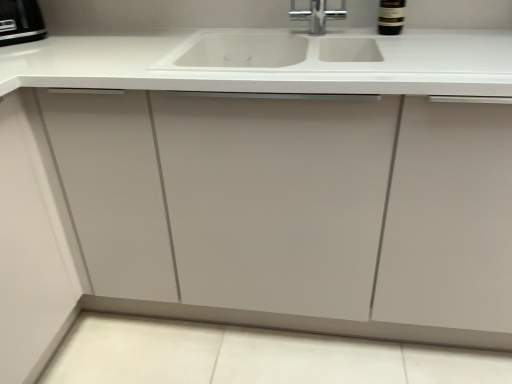
The height and width of the screenshot is (384, 512). I want to click on dark brown glass bottle at upper right, so click(391, 17).

What do you see at coordinates (391, 17) in the screenshot? I see `dark brown glass bottle at upper right` at bounding box center [391, 17].

Describe the element at coordinates (269, 62) in the screenshot. The width and height of the screenshot is (512, 384). I see `white matte sink at center` at that location.

What do you see at coordinates (20, 22) in the screenshot?
I see `black plastic toaster at upper left` at bounding box center [20, 22].

This screenshot has height=384, width=512. I want to click on dark brown glass bottle at upper right, so click(391, 17).

Which object is further away from the camera, black plastic toaster at upper left or dark brown glass bottle at upper right?

black plastic toaster at upper left is further from the camera.

Between point (6, 27) and point (392, 1), which one is positioned behind?

Positioned behind is point (392, 1).

Considering the relative sizes of black plastic toaster at upper left and dark brown glass bottle at upper right in the image provided, is black plastic toaster at upper left thinner than dark brown glass bottle at upper right?

Incorrect, the width of black plastic toaster at upper left is not less than that of dark brown glass bottle at upper right.

I want to click on wine bottle on the right of the black plastic toaster at upper left, so click(x=391, y=17).

Where is `countertop that is in front of the dark brown glass bottle at upper right`? countertop that is in front of the dark brown glass bottle at upper right is located at coordinates (269, 62).

Between dark brown glass bottle at upper right and white matte sink at center, which one has less height?

white matte sink at center.

Considering the relative sizes of dark brown glass bottle at upper right and white matte sink at center in the image provided, is dark brown glass bottle at upper right wider than white matte sink at center?

No.

Is dark brown glass bottle at upper right oriented away from white matte sink at center?

No, dark brown glass bottle at upper right is not facing away from white matte sink at center.

Where is `countertop in front of the black plastic toaster at upper left`? This screenshot has height=384, width=512. countertop in front of the black plastic toaster at upper left is located at coordinates (269, 62).

Can you confirm if white matte sink at center is shorter than black plastic toaster at upper left?

No, white matte sink at center is not shorter than black plastic toaster at upper left.

Between white matte sink at center and black plastic toaster at upper left, which one has larger width?

white matte sink at center.

Considering their positions, is white matte sink at center located in front of or behind black plastic toaster at upper left?

In the image, white matte sink at center appears in front of black plastic toaster at upper left.

In terms of size, does dark brown glass bottle at upper right appear bigger or smaller than black plastic toaster at upper left?

Clearly, dark brown glass bottle at upper right is smaller in size than black plastic toaster at upper left.

Considering the points (395, 10) and (4, 19), which point is behind, point (395, 10) or point (4, 19)?

The point (395, 10) is farther.

In terms of width, does dark brown glass bottle at upper right look wider or thinner when compared to black plastic toaster at upper left?

In the image, dark brown glass bottle at upper right appears to be more narrow than black plastic toaster at upper left.

Is dark brown glass bottle at upper right not close to black plastic toaster at upper left?

Yes, dark brown glass bottle at upper right is far from black plastic toaster at upper left.

How distant is white matte sink at center from dark brown glass bottle at upper right?

They are 20.61 inches apart.

From a real-world perspective, who is located lower, white matte sink at center or dark brown glass bottle at upper right?

white matte sink at center.

Does point (154, 74) lie in front of point (385, 29)?

That is True.

Which object is further away from the camera, white matte sink at center or dark brown glass bottle at upper right?

dark brown glass bottle at upper right is behind.

Is black plastic toaster at upper left in contact with white matte sink at center?

black plastic toaster at upper left is not next to white matte sink at center, and they're not touching.

From the picture: Do you think black plastic toaster at upper left is within white matte sink at center, or outside of it?

black plastic toaster at upper left exists outside the volume of white matte sink at center.

Can you confirm if black plastic toaster at upper left is wider than white matte sink at center?

No, black plastic toaster at upper left is not wider than white matte sink at center.

This screenshot has width=512, height=384. In order to click on appliance located underneath the dark brown glass bottle at upper right (from a real-world perspective) in this screenshot , I will do `click(20, 22)`.

In the image, there is a white matte sink at center. Identify the location of wine bottle above it (from the image's perspective). This screenshot has height=384, width=512. (391, 17).

When comparing their distances from white matte sink at center, does black plastic toaster at upper left or dark brown glass bottle at upper right seem closer?

Based on the image, dark brown glass bottle at upper right appears to be nearer to white matte sink at center.

From the picture: When comparing their distances from black plastic toaster at upper left, does dark brown glass bottle at upper right or white matte sink at center seem closer?

white matte sink at center is positioned closer to the anchor black plastic toaster at upper left.

Considering their positions, is dark brown glass bottle at upper right positioned closer to white matte sink at center than black plastic toaster at upper left?

Based on the image, dark brown glass bottle at upper right appears to be nearer to white matte sink at center.

When comparing their distances from dark brown glass bottle at upper right, does white matte sink at center or black plastic toaster at upper left seem further?

Based on the image, black plastic toaster at upper left appears to be further to dark brown glass bottle at upper right.

From the picture: Looking at the image, which one is located closer to dark brown glass bottle at upper right, black plastic toaster at upper left or white matte sink at center?

Among the two, white matte sink at center is located nearer to dark brown glass bottle at upper right.

From the image, which object appears to be nearer to black plastic toaster at upper left, white matte sink at center or dark brown glass bottle at upper right?

The object closer to black plastic toaster at upper left is white matte sink at center.

The image size is (512, 384). In order to click on countertop between black plastic toaster at upper left and dark brown glass bottle at upper right in the horizontal direction in this screenshot , I will do `click(269, 62)`.